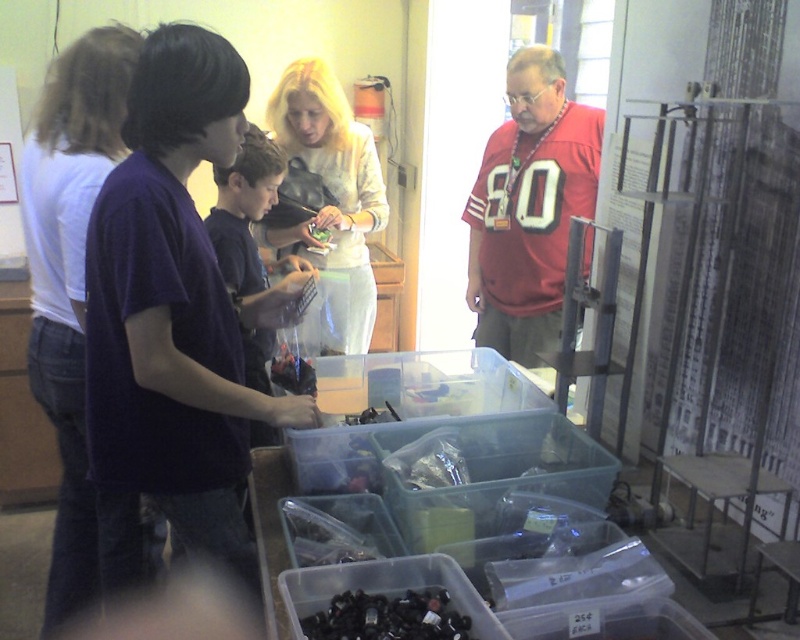
You are standing in front of the table with the clear plastic bins. There are two points marked on the table surface. One is at coordinate point (532,92) and the other is at point (358,609). Which of these two points is closer to you?

The point at coordinate (532,92) is closer to you because it is further to the viewer than point (358,609).

You are a new volunteer at a sorting station and see the red jersey at center and the black plastic bottle at lower center. Which item is placed higher up on the table?

The red jersey at center is located above the black plastic bottle at lower center, so it is placed higher up on the table.

You are standing at the back of the table and want to hand a tool to the white cotton shirt at left and the red jersey at center. Which one can you reach without moving any bins?

The white cotton shirt at left is in front of the red jersey at center, so you can reach the white cotton shirt at left without moving any bins.